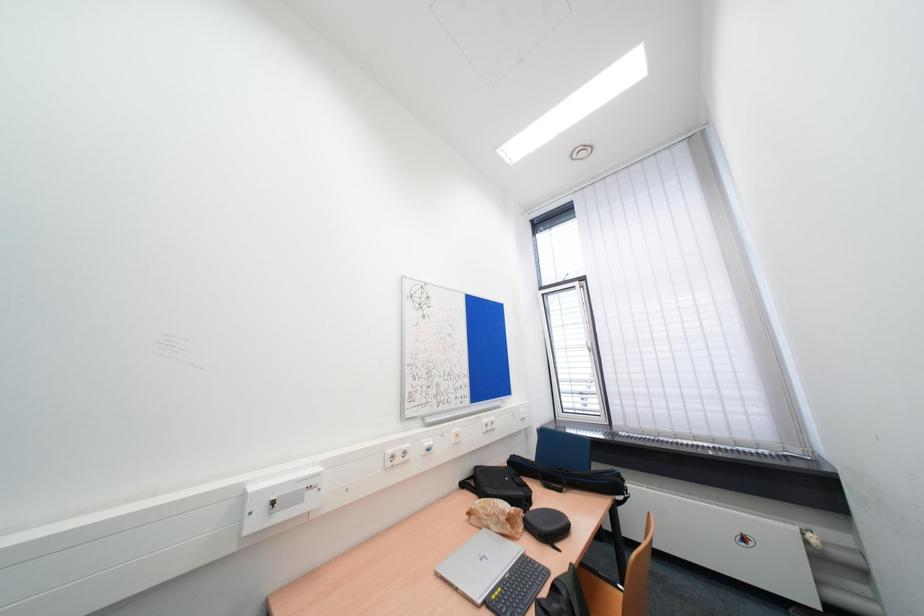
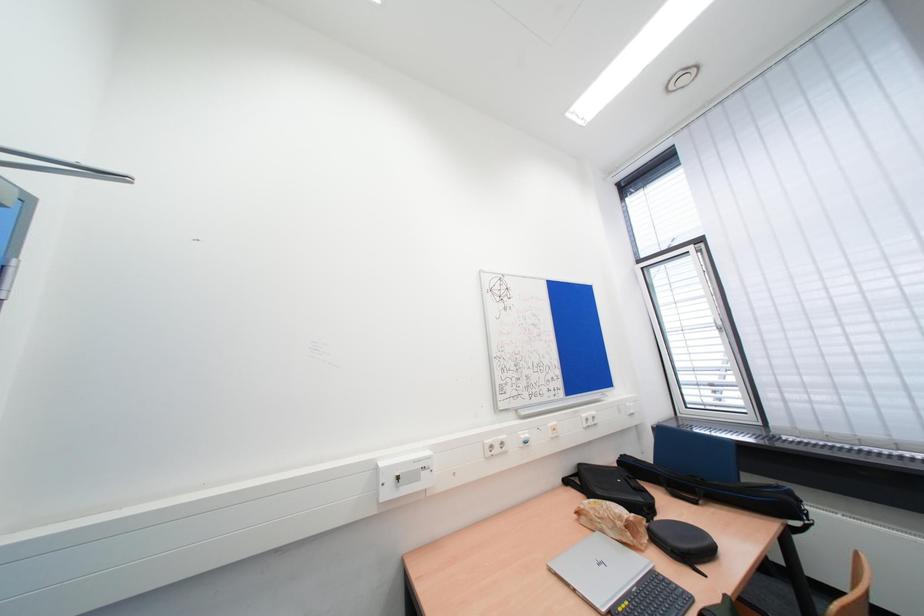
Question: Based on the continuous images, in which direction is the camera rotating? Reply with the corresponding letter.

Choices:
 (A) Left
 (B) Right
 (C) Up
 (D) Down

Answer: (A)